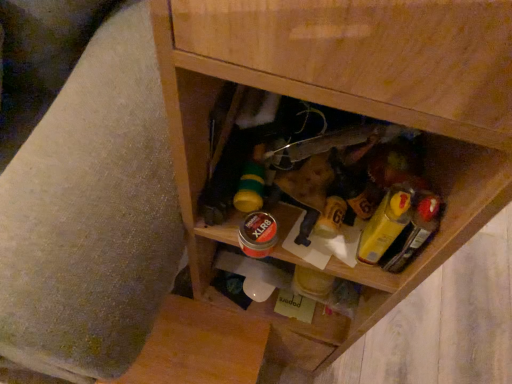
What do you see at coordinates (385, 224) in the screenshot? I see `yellow plastic mustard at center right` at bounding box center [385, 224].

I want to click on yellow plastic mustard at center right, so click(x=385, y=224).

Where is `wooden swivel chair at lower right`? Image resolution: width=512 pixels, height=384 pixels. wooden swivel chair at lower right is located at coordinates (83, 188).

You are a GUI agent. You are given a task and a screenshot of the screen. Output one action in this format:
    pyautogui.click(x=<x>, y=<y>)
    Task: Click on the yellow plastic mustard at center right
    The image size is (512, 384).
    Given the screenshot: What is the action you would take?
    pyautogui.click(x=385, y=224)

Does wooden swivel chair at lower right have a smaller size compared to yellow plastic mustard at center right?

Actually, wooden swivel chair at lower right might be larger than yellow plastic mustard at center right.

Is yellow plastic mustard at center right completely or partially inside wooden swivel chair at lower right?

No, wooden swivel chair at lower right does not contain yellow plastic mustard at center right.

Is wooden swivel chair at lower right placed right next to yellow plastic mustard at center right?

There is a gap between wooden swivel chair at lower right and yellow plastic mustard at center right.

In the scene shown: Does wooden swivel chair at lower right have a greater width compared to wooden cabinet at center?

Indeed, wooden swivel chair at lower right has a greater width compared to wooden cabinet at center.

Considering the sizes of objects wooden swivel chair at lower right and wooden cabinet at center in the image provided, who is taller, wooden swivel chair at lower right or wooden cabinet at center?

With more height is wooden cabinet at center.

Can you confirm if wooden swivel chair at lower right is smaller than wooden cabinet at center?

No, wooden swivel chair at lower right is not smaller than wooden cabinet at center.

Where is `cabinetry that is in front of the yellow plastic mustard at center right`? The height and width of the screenshot is (384, 512). cabinetry that is in front of the yellow plastic mustard at center right is located at coordinates (348, 110).

From the image's perspective, which is above, yellow plastic mustard at center right or wooden cabinet at center?

wooden cabinet at center, from the image's perspective.

How many degrees apart are the facing directions of yellow plastic mustard at center right and wooden cabinet at center?

They differ by 2.05 degrees in their facing directions.

Is wooden cabinet at center at the left side of wooden swivel chair at lower right?

Incorrect, wooden cabinet at center is not on the left side of wooden swivel chair at lower right.

From a real-world perspective, between wooden cabinet at center and wooden swivel chair at lower right, who is vertically higher?

In real-world perspective, wooden cabinet at center is above.

Which is further, (248, 62) or (53, 107)?

Point (53, 107)

Based on their positions, is yellow plastic mustard at center right located to the left or right of wooden swivel chair at lower right?

In the image, yellow plastic mustard at center right appears on the right side of wooden swivel chair at lower right.

From the picture: Is yellow plastic mustard at center right with wooden swivel chair at lower right?

yellow plastic mustard at center right is not next to wooden swivel chair at lower right, and they're not touching.

Which of these two, yellow plastic mustard at center right or wooden swivel chair at lower right, stands shorter?

With less height is yellow plastic mustard at center right.

Which of these two, yellow plastic mustard at center right or wooden swivel chair at lower right, is smaller?

yellow plastic mustard at center right is smaller.

How many degrees apart are the facing directions of wooden cabinet at center and yellow plastic mustard at center right?

2.05 degrees separate the facing orientations of wooden cabinet at center and yellow plastic mustard at center right.

Considering the relative sizes of wooden cabinet at center and yellow plastic mustard at center right in the image provided, is wooden cabinet at center taller than yellow plastic mustard at center right?

Correct, wooden cabinet at center is much taller as yellow plastic mustard at center right.

Is wooden cabinet at center far from yellow plastic mustard at center right?

No, wooden cabinet at center is in close proximity to yellow plastic mustard at center right.

Locate an element on the screen. The image size is (512, 384). mustard below the wooden cabinet at center (from the image's perspective) is located at coordinates (385, 224).

Find the location of a particular element. The image size is (512, 384). swivel chair in front of the yellow plastic mustard at center right is located at coordinates (83, 188).

Image resolution: width=512 pixels, height=384 pixels. In order to click on swivel chair above the wooden cabinet at center (from the image's perspective) in this screenshot , I will do `click(83, 188)`.

From the picture: From the image, which object appears to be nearer to wooden cabinet at center, wooden swivel chair at lower right or yellow plastic mustard at center right?

yellow plastic mustard at center right is positioned closer to the anchor wooden cabinet at center.

From the image, which object appears to be farther from wooden swivel chair at lower right, yellow plastic mustard at center right or wooden cabinet at center?

Among the two, yellow plastic mustard at center right is located further to wooden swivel chair at lower right.

When comparing their distances from wooden swivel chair at lower right, does wooden cabinet at center or yellow plastic mustard at center right seem further?

Based on the image, yellow plastic mustard at center right appears to be further to wooden swivel chair at lower right.

From the image, which object appears to be farther from yellow plastic mustard at center right, wooden cabinet at center or wooden swivel chair at lower right?

wooden swivel chair at lower right lies further to yellow plastic mustard at center right than the other object.

Considering their positions, is yellow plastic mustard at center right positioned closer to wooden cabinet at center than wooden swivel chair at lower right?

yellow plastic mustard at center right is closer to wooden cabinet at center.

From the image, which object appears to be farther from yellow plastic mustard at center right, wooden swivel chair at lower right or wooden cabinet at center?

wooden swivel chair at lower right.

Find the location of `cabinetry between wooden swivel chair at lower right and yellow plastic mustard at center right from left to right`. cabinetry between wooden swivel chair at lower right and yellow plastic mustard at center right from left to right is located at coordinates (348, 110).